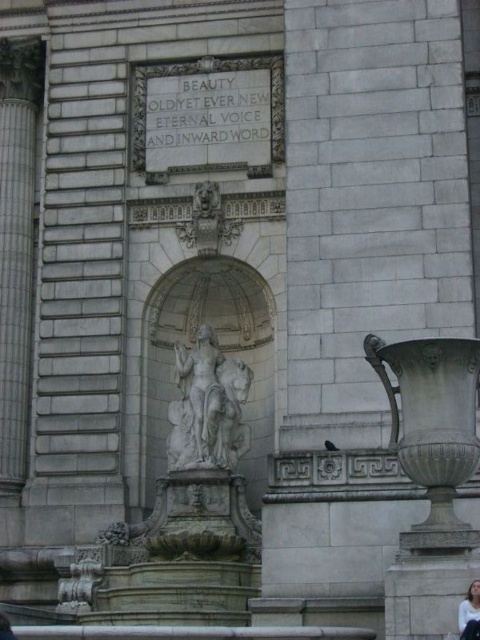
You are an art student analyzing the proportions of the white marble statue at center and the white fabric at lower right in the image. Which object is shorter?

The white marble statue at center is shorter than the white fabric at lower right.

You are standing in front of the grand stone building and notice two points marked on the facade. The first point is at coordinates point (181, 454) and the second is at point (468, 588). Which point is closer to you?

Point (181, 454) is further to the camera than point (468, 588). Therefore, the point closer to you is point (468, 588).